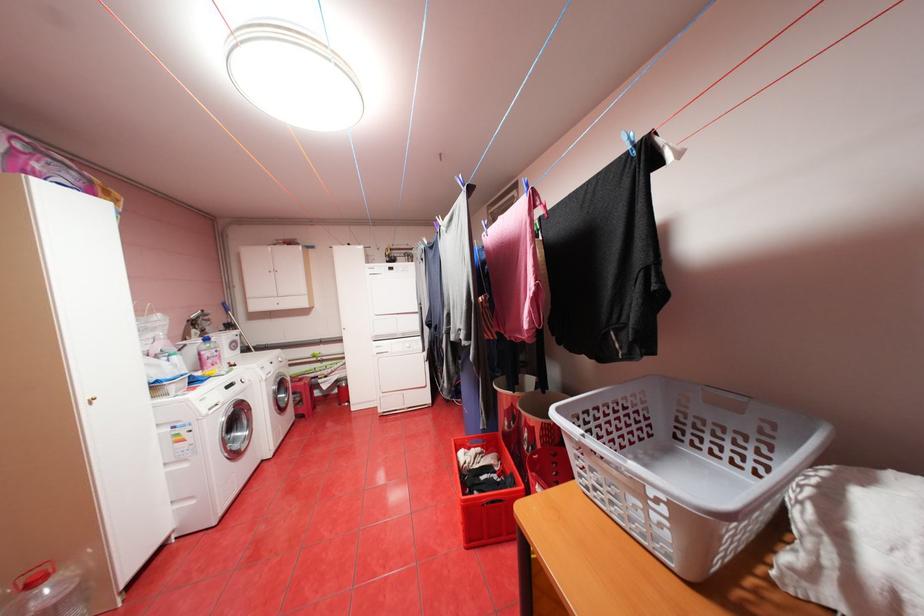
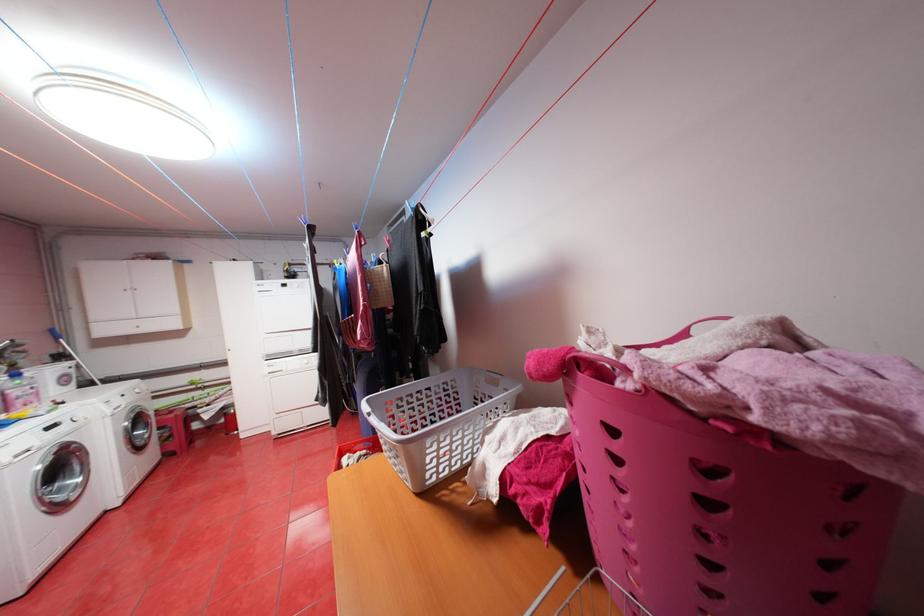
Question: The images are taken continuously from a first-person perspective. In which direction is your viewpoint rotating?

Choices:
 (A) Left
 (B) Right
 (C) Up
 (D) Down

Answer: (B)